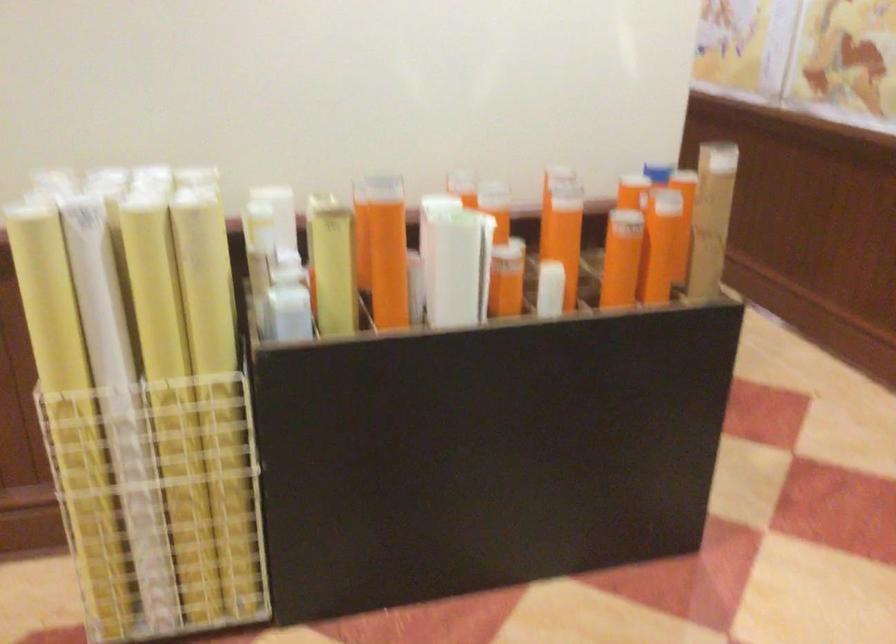
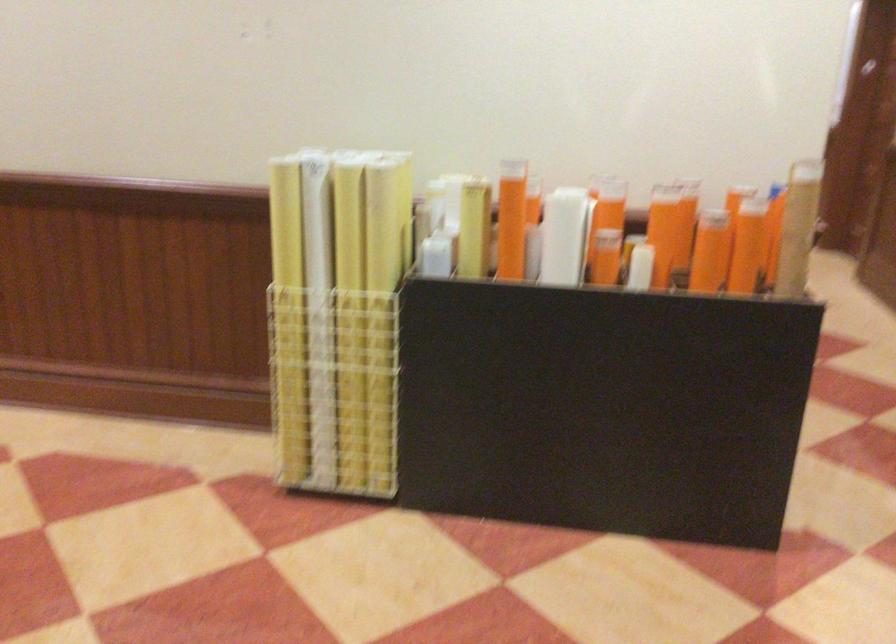
The point at (x=125, y=424) is marked in the first image. Where is the corresponding point in the second image?

(319, 319)